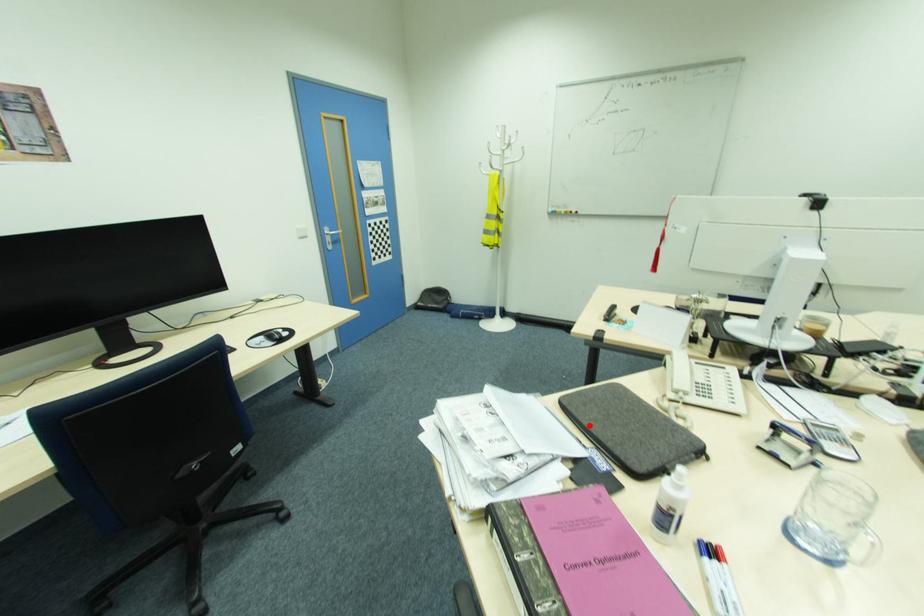
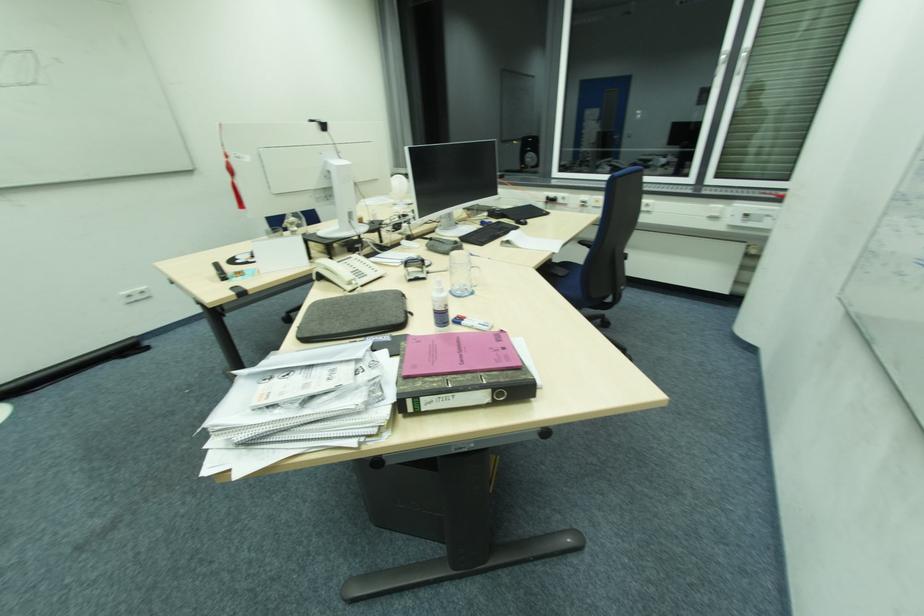
Locate, in the second image, the point that corresponds to the highlighted location in the first image.

(348, 331)